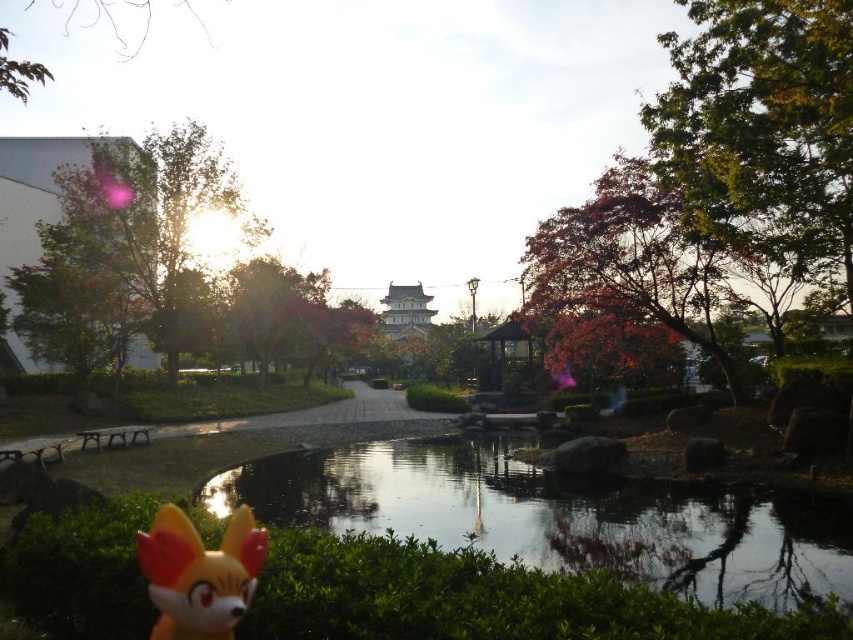
Question: Which of the following is the closest to the observer?

Choices:
 (A) (161, 548)
 (B) (782, 513)

Answer: (A)

Question: Can you confirm if transparent glass water at center is positioned to the left of matte orange plush toy at lower left?

Choices:
 (A) no
 (B) yes

Answer: (A)

Question: Does transparent glass water at center have a larger size compared to matte orange plush toy at lower left?

Choices:
 (A) no
 (B) yes

Answer: (B)

Question: Which point is farther to the camera?

Choices:
 (A) (614, 556)
 (B) (161, 589)

Answer: (A)

Question: Is transparent glass water at center in front of matte orange plush toy at lower left?

Choices:
 (A) yes
 (B) no

Answer: (B)